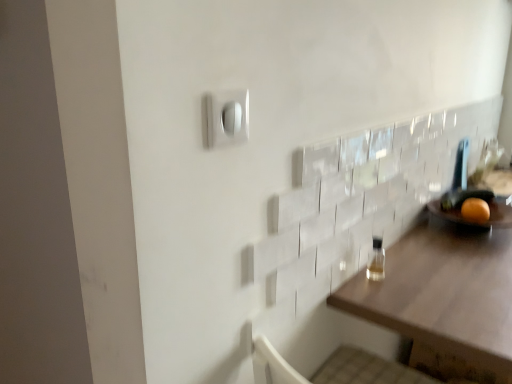
Identify the location of vacant point to the right of clear glass bottle at right. pyautogui.click(x=435, y=279).